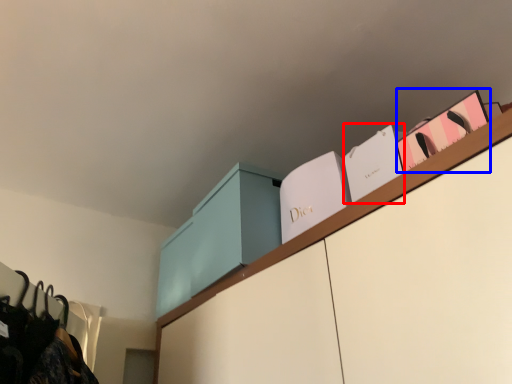
Question: Which object appears closest to the camera in this image, book (highlighted by a red box) or book (highlighted by a blue box)?

Choices:
 (A) book
 (B) book

Answer: (B)